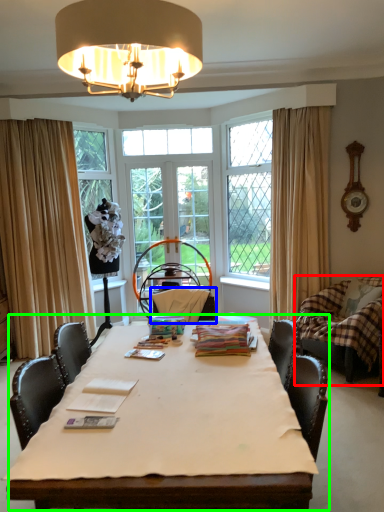
Question: Which object is positioned farthest from swivel chair (highlighted by a red box)? Select from armchair (highlighted by a blue box) and table (highlighted by a green box).

Choices:
 (A) armchair
 (B) table

Answer: (B)